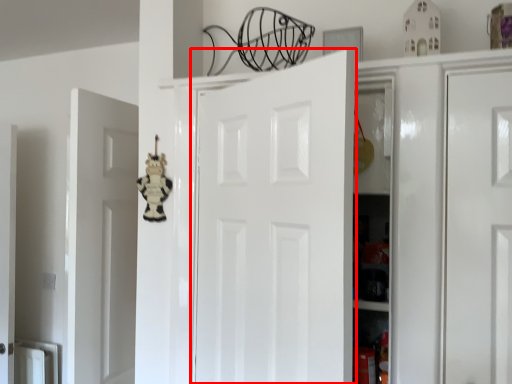
Question: Observing the image, what is the correct spatial positioning of door (annotated by the red box) in reference to toy?

Choices:
 (A) left
 (B) right

Answer: (B)